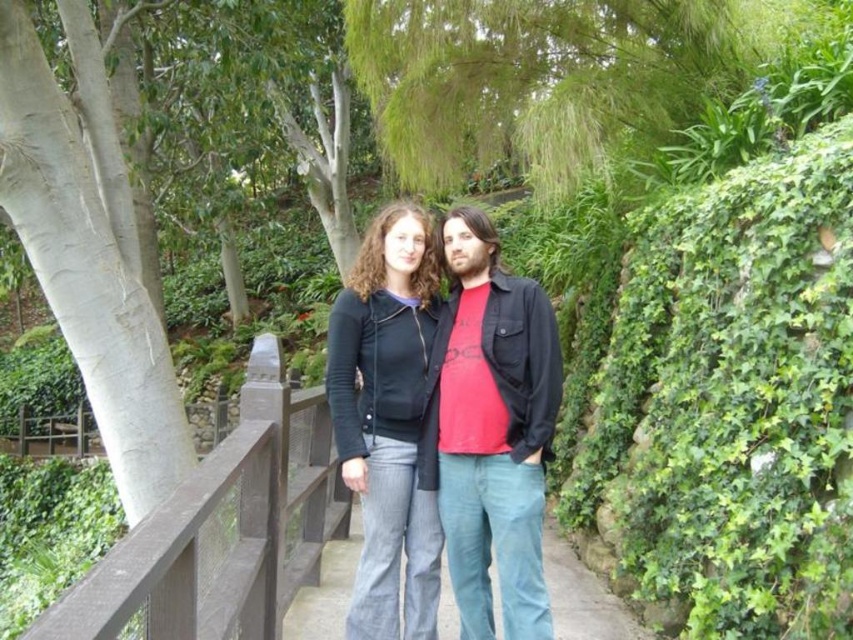
Question: Which object is positioned closest to the brown wooden rail at center?

Choices:
 (A) matte black jacket at center
 (B) blue jeans at center

Answer: (A)

Question: Which point is farther from the camera taking this photo?

Choices:
 (A) (339, 576)
 (B) (321, 515)

Answer: (A)

Question: Which point is closer to the camera taking this photo?

Choices:
 (A) (370, 561)
 (B) (280, 360)
 (C) (575, 580)

Answer: (B)

Question: Is matte black jacket at center above brown wooden rail at center?

Choices:
 (A) no
 (B) yes

Answer: (B)

Question: Is matte black jacket at center above blue jeans at center?

Choices:
 (A) yes
 (B) no

Answer: (A)

Question: In this image, where is matte black jacket at center located relative to blue jeans at center?

Choices:
 (A) above
 (B) below

Answer: (A)